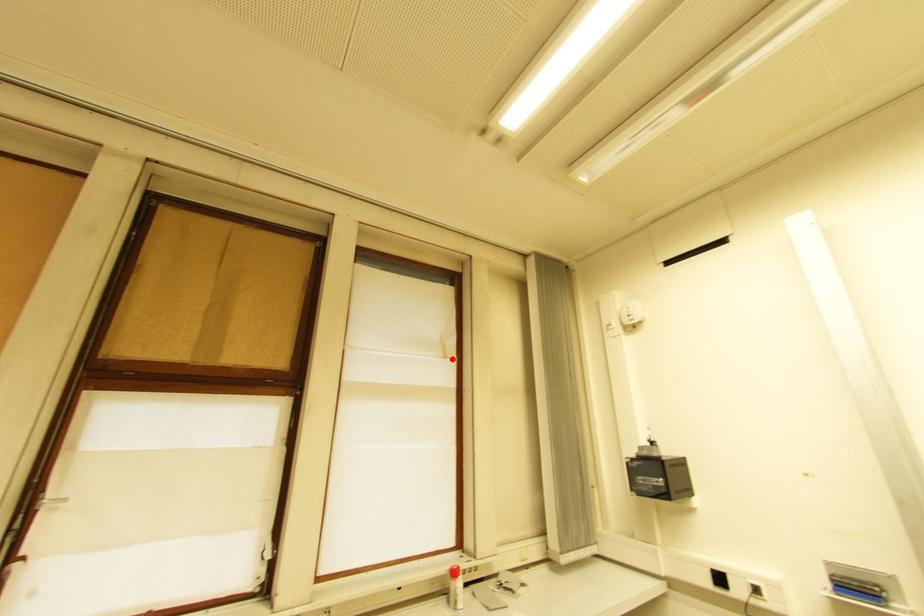
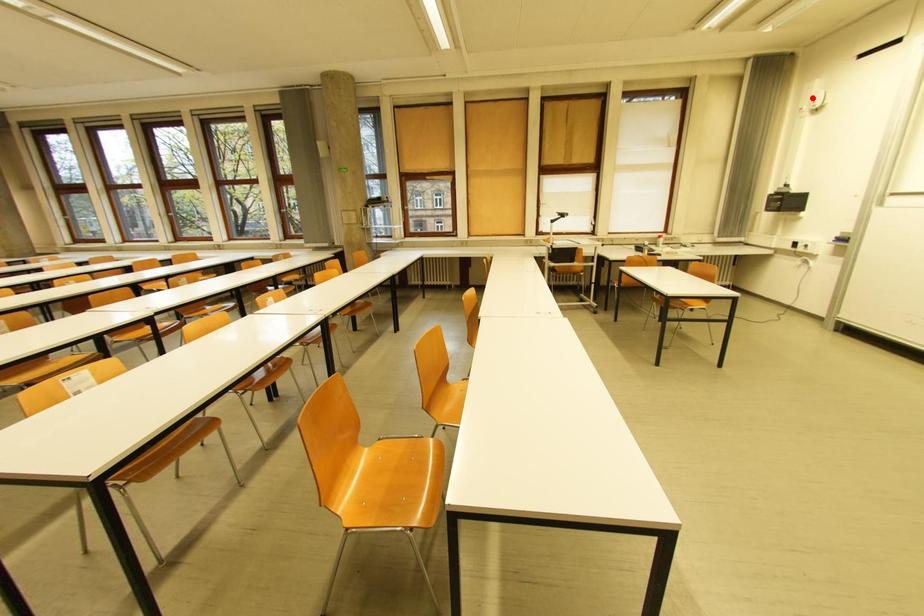
I am providing you with two images of the same scene from different viewpoints. A red point is marked on the first image and another point is marked on the second image. Is the red point in image1 aligned with the point shown in image2?

No